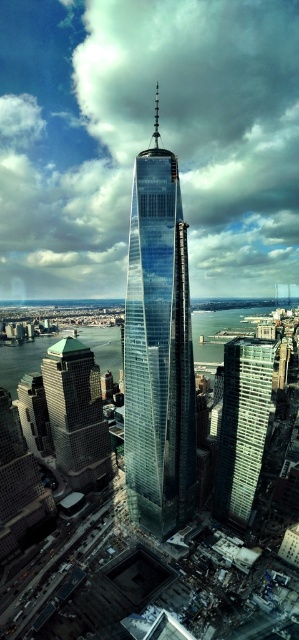
Question: Based on their relative distances, which object is nearer to the transparent glass skyscraper at center?

Choices:
 (A) green glass building at lower left
 (B) glassy steel skyscraper at center

Answer: (B)

Question: From the image, what is the correct spatial relationship of transparent glass skyscraper at center in relation to glassy steel skyscraper at center?

Choices:
 (A) right
 (B) left

Answer: (B)

Question: Which of the following is the closest to the observer?

Choices:
 (A) (159, 161)
 (B) (261, 426)
 (C) (86, 396)

Answer: (B)

Question: Is transparent glass skyscraper at center further to camera compared to green glass building at lower left?

Choices:
 (A) yes
 (B) no

Answer: (B)

Question: Can you confirm if transparent glass skyscraper at center is thinner than glassy steel skyscraper at center?

Choices:
 (A) no
 (B) yes

Answer: (A)

Question: Which object is closer to the camera taking this photo?

Choices:
 (A) transparent glass skyscraper at center
 (B) glassy steel skyscraper at center

Answer: (B)